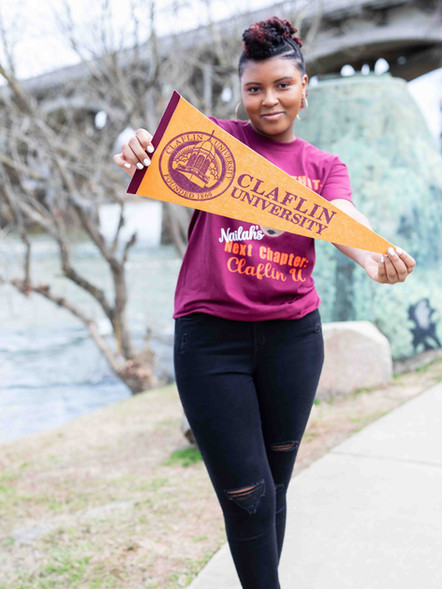
This screenshot has width=442, height=589. In order to click on pennant in this screenshot , I will do `click(264, 187)`.